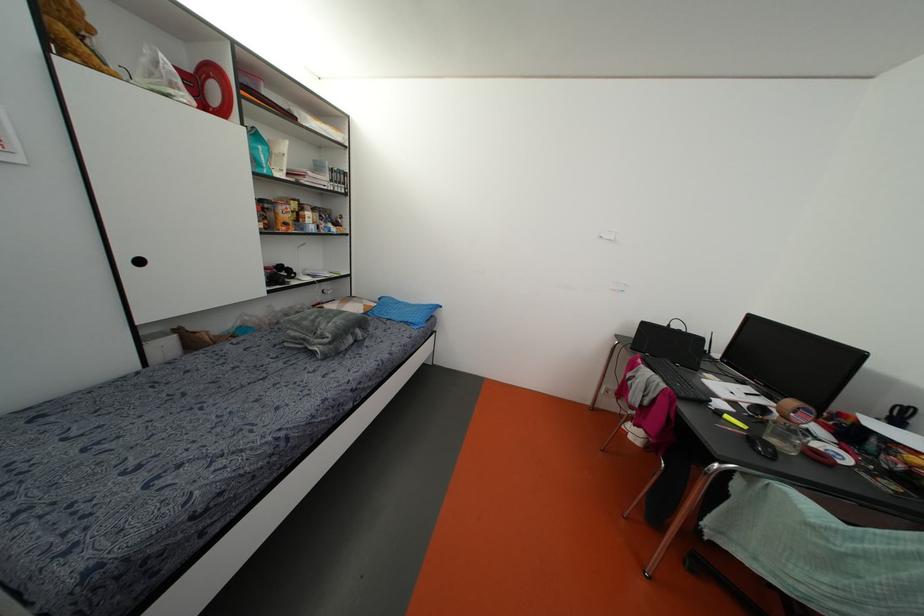
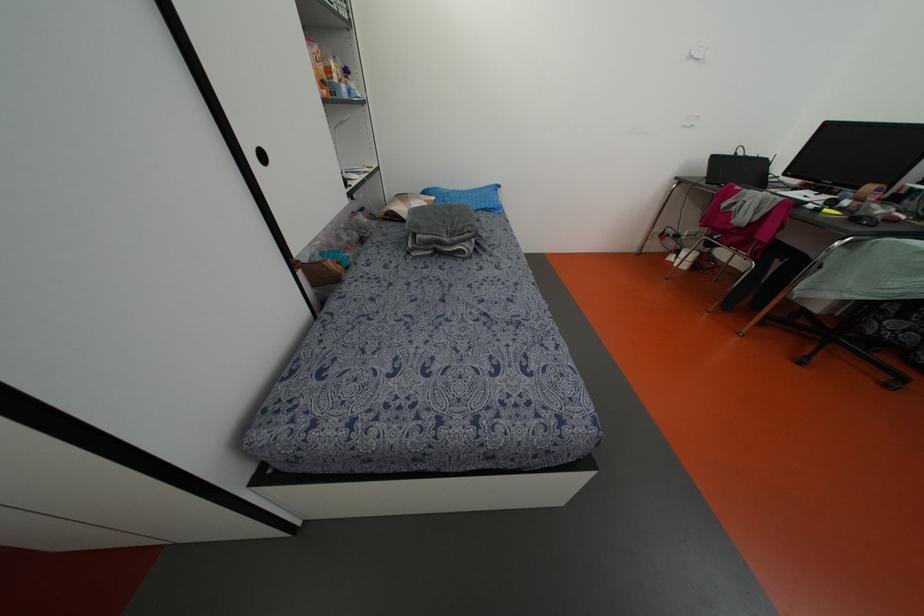
In the second image, find the point that corresponds to (411,321) in the first image.

(492, 206)